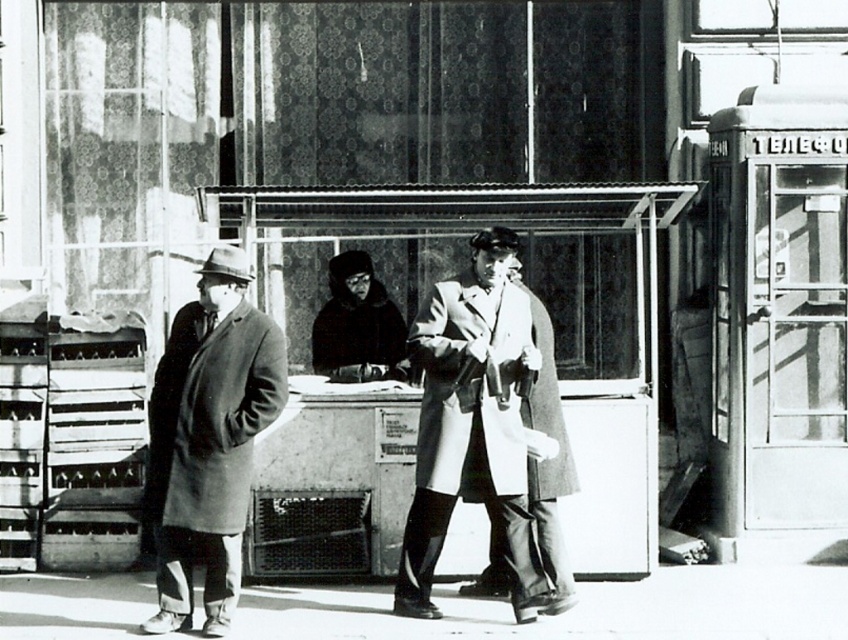
Where is `metallic gray kiosk at center`? This screenshot has height=640, width=848. metallic gray kiosk at center is located at coordinates (421, 378).

Is metallic gray kiosk at center to the right of light gray wool coat at center from the viewer's perspective?

In fact, metallic gray kiosk at center is to the left of light gray wool coat at center.

The image size is (848, 640). I want to click on metallic gray kiosk at center, so click(421, 378).

You are a GUI agent. You are given a task and a screenshot of the screen. Output one action in this format:
    pyautogui.click(x=<x>, y=<y>)
    Task: Click on the metallic gray kiosk at center
    The image size is (848, 640).
    Given the screenshot: What is the action you would take?
    pyautogui.click(x=421, y=378)

Is metallic gray kiosk at center wider than velvet black coat at center?

Yes, metallic gray kiosk at center is wider than velvet black coat at center.

Can you confirm if metallic gray kiosk at center is thinner than velvet black coat at center?

No.

The image size is (848, 640). Identify the location of metallic gray kiosk at center. (421, 378).

Who is positioned more to the left, light gray wool coat at center or matte gray coat at left?

matte gray coat at left is more to the left.

Between point (477, 448) and point (232, 532), which one is positioned in front?

Positioned in front is point (232, 532).

Where is `light gray wool coat at center`? This screenshot has height=640, width=848. light gray wool coat at center is located at coordinates (472, 422).